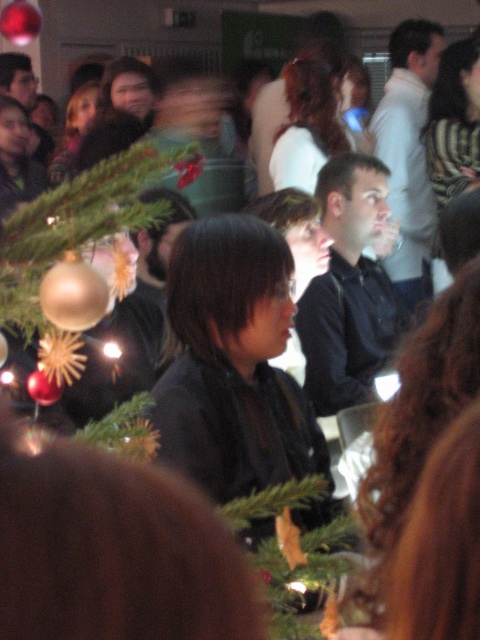
Does point (112, 211) lie in front of point (276, 552)?

Yes, it is.

Who is more forward, (1,298) or (286,540)?

Point (1,298) is more forward.

Who is more forward, (x=32, y=269) or (x=262, y=508)?

Point (x=32, y=269)

Where is `gold metallic ornament at center`? The width and height of the screenshot is (480, 640). gold metallic ornament at center is located at coordinates [74, 240].